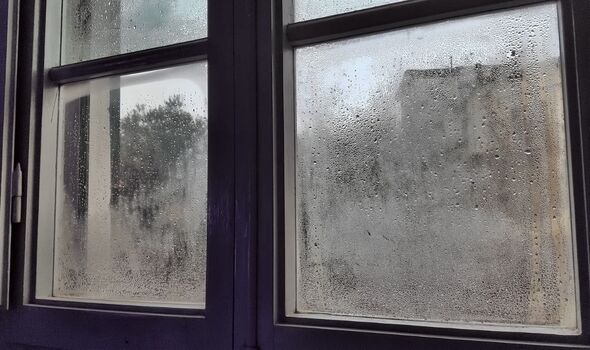
At what (x,y) coordinates should I click in order to perform the action: click on fog on windows. Please return your answer as a coordinate pair (x, y). Image resolution: width=590 pixels, height=350 pixels. Looking at the image, I should click on (384, 232), (182, 205), (135, 33).